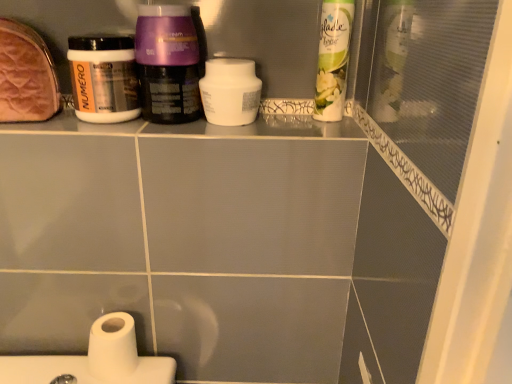
Question: Can you confirm if white matte jar at upper left, which ranks as the 2th bottle in right-to-left order, is smaller than white matte toilet paper at lower left?

Choices:
 (A) yes
 (B) no

Answer: (B)

Question: Is white matte jar at upper left, the 1th bottle from the left, touching white matte toilet paper at lower left?

Choices:
 (A) yes
 (B) no

Answer: (B)

Question: Is white matte jar at upper left, which ranks as the 2th bottle in right-to-left order, behind white matte toilet paper at lower left?

Choices:
 (A) no
 (B) yes

Answer: (A)

Question: From the image's perspective, is white matte jar at upper left, the 1th bottle from the left, located beneath white matte toilet paper at lower left?

Choices:
 (A) yes
 (B) no

Answer: (B)

Question: Does white matte jar at upper left, the 1th bottle from the left, appear on the left side of white matte toilet paper at lower left?

Choices:
 (A) no
 (B) yes

Answer: (B)

Question: Can you confirm if white matte jar at upper left, the 1th bottle from the left, is taller than white matte toilet paper at lower left?

Choices:
 (A) yes
 (B) no

Answer: (A)

Question: Is purple glossy cream at center, which is the 2th bottle in left-to-right order, at the right side of white glossy air freshener at upper right, which is the first cleaning product from right to left?

Choices:
 (A) yes
 (B) no

Answer: (B)

Question: Is purple glossy cream at center, which is the 2th bottle in left-to-right order, completely or partially outside of white glossy air freshener at upper right, the second cleaning product when ordered from left to right?

Choices:
 (A) yes
 (B) no

Answer: (A)

Question: From a real-world perspective, is purple glossy cream at center, the first bottle when ordered from right to left, over white glossy air freshener at upper right, which is the first cleaning product from right to left?

Choices:
 (A) no
 (B) yes

Answer: (A)

Question: Considering the relative sizes of purple glossy cream at center, which is the 2th bottle in left-to-right order, and white glossy air freshener at upper right, which is the first cleaning product from right to left, in the image provided, is purple glossy cream at center, which is the 2th bottle in left-to-right order, taller than white glossy air freshener at upper right, which is the first cleaning product from right to left,?

Choices:
 (A) yes
 (B) no

Answer: (B)

Question: Is purple glossy cream at center, which is the 2th bottle in left-to-right order, at the left side of white glossy air freshener at upper right, which is the first cleaning product from right to left?

Choices:
 (A) no
 (B) yes

Answer: (B)

Question: Is there a large distance between purple glossy cream at center, which is the 2th bottle in left-to-right order, and white glossy air freshener at upper right, which is the first cleaning product from right to left?

Choices:
 (A) no
 (B) yes

Answer: (A)

Question: From the image's perspective, is white glossy air freshener at upper right, which is the first cleaning product from right to left, on top of white matte toilet paper at lower left?

Choices:
 (A) no
 (B) yes

Answer: (B)